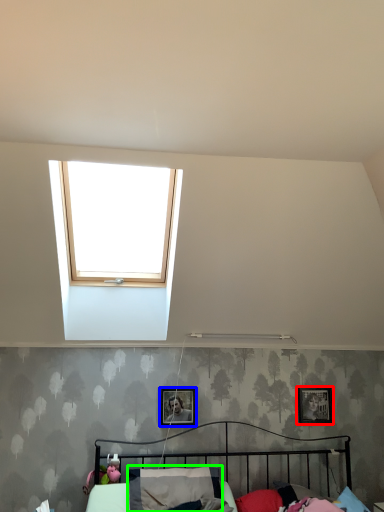
Question: Considering the real-world distances, which object is farthest from picture frame (highlighted by a red box)? picture frame (highlighted by a blue box) or pillow (highlighted by a green box)?

Choices:
 (A) picture frame
 (B) pillow

Answer: (B)